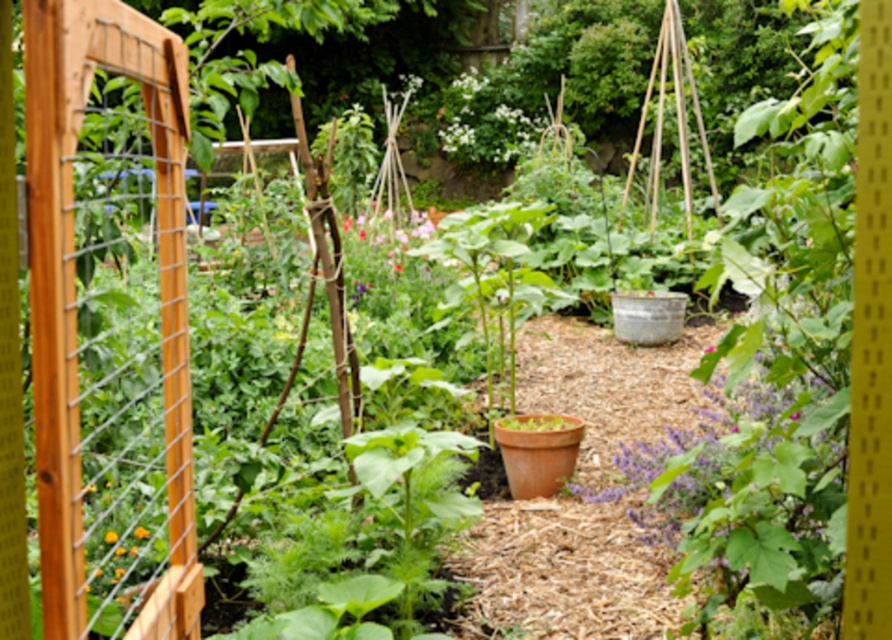
You are a gardener who wants to plant a new flower that needs at least 6 meters of space between it and the nearest flower. You have the pink matte flower at center and the orange matte flower at center in your garden. Can you plant the new flower between them without violating the spacing requirement?

The distance between the pink matte flower at center and the orange matte flower at center is 5.97 meters, which is less than the required 6 meters. Therefore, planting a new flower between them would not meet the spacing requirement.

You are a gardener looking at the garden scene. You see a pink matte flower at center and an orange matte flower at center. Which flower is positioned higher in the image?

The pink matte flower at center is located above the orange matte flower at center, so it is positioned higher in the image.